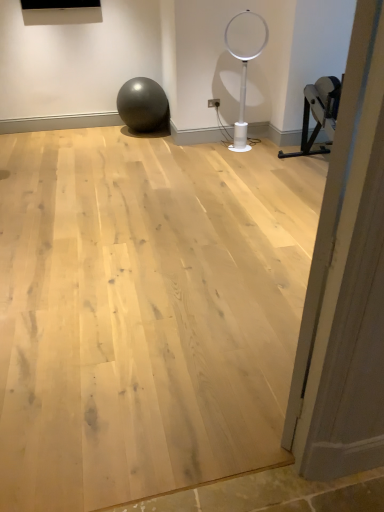
At what (x,y) coordinates should I click in order to perform the action: click on vacant space to the left of wooden door at right. Please return your answer as a coordinate pair (x, y). The width and height of the screenshot is (384, 512). Looking at the image, I should click on (233, 386).